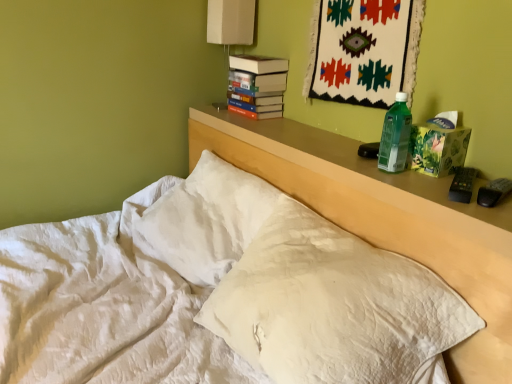
Question: Is white quilted pillow at center located within white fabric lampshade at upper center?

Choices:
 (A) yes
 (B) no

Answer: (B)

Question: Is white fabric lampshade at upper center outside of white quilted pillow at center?

Choices:
 (A) yes
 (B) no

Answer: (A)

Question: Is white fabric lampshade at upper center beside white quilted pillow at center?

Choices:
 (A) yes
 (B) no

Answer: (B)

Question: From the image's perspective, is white fabric lampshade at upper center located above white quilted pillow at center?

Choices:
 (A) no
 (B) yes

Answer: (B)

Question: Considering the relative sizes of white fabric lampshade at upper center and white quilted pillow at center in the image provided, is white fabric lampshade at upper center thinner than white quilted pillow at center?

Choices:
 (A) yes
 (B) no

Answer: (A)

Question: Considering the relative positions of white fabric lampshade at upper center and white quilted pillow at center in the image provided, is white fabric lampshade at upper center behind white quilted pillow at center?

Choices:
 (A) no
 (B) yes

Answer: (B)

Question: From a real-world perspective, does hardcover books at upper center stand above white quilted pillow at center?

Choices:
 (A) no
 (B) yes

Answer: (B)

Question: Does hardcover books at upper center have a larger size compared to white quilted pillow at center?

Choices:
 (A) yes
 (B) no

Answer: (B)

Question: Is hardcover books at upper center wider than white quilted pillow at center?

Choices:
 (A) no
 (B) yes

Answer: (A)

Question: Is hardcover books at upper center positioned with its back to white quilted pillow at center?

Choices:
 (A) yes
 (B) no

Answer: (B)

Question: Is the position of hardcover books at upper center more distant than that of white quilted pillow at center?

Choices:
 (A) yes
 (B) no

Answer: (A)

Question: Is hardcover books at upper center at the right side of white quilted pillow at center?

Choices:
 (A) no
 (B) yes

Answer: (A)

Question: Does green plastic bottle at right lie behind white quilted pillow at center?

Choices:
 (A) yes
 (B) no

Answer: (A)